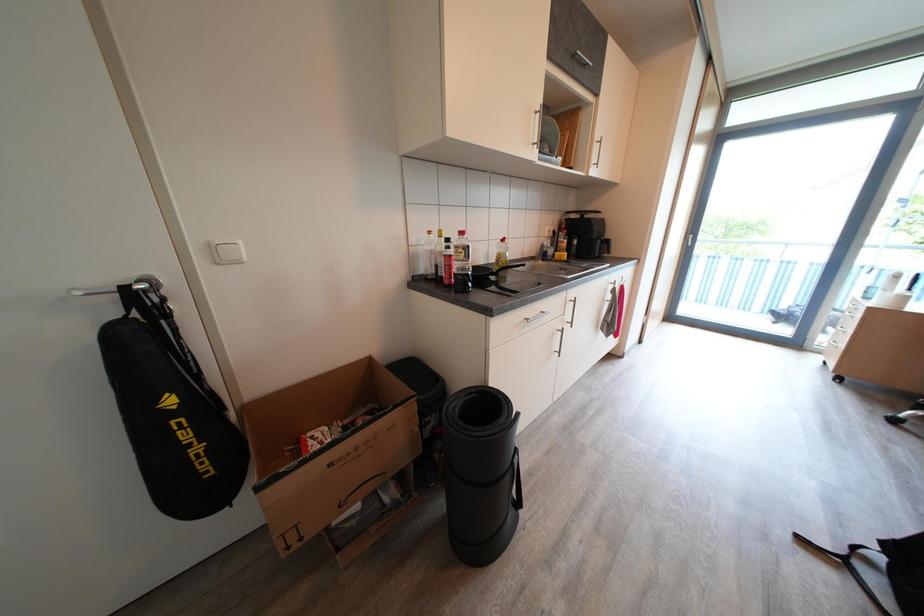
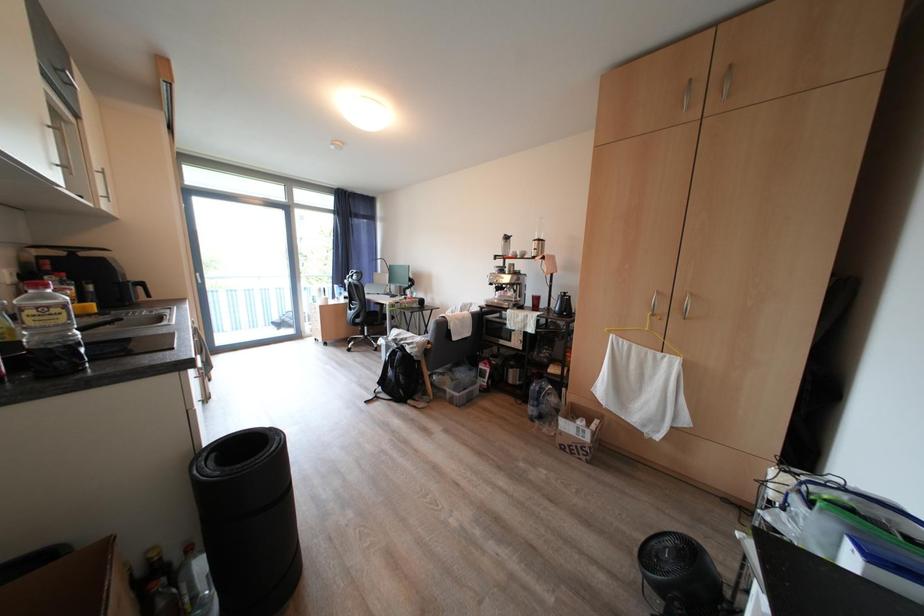
Question: The camera is either moving clockwise (left) or counter-clockwise (right) around the object. The first image is from the beginning of the video and the second image is from the end. Is the camera moving left or right when shooting the video?

Choices:
 (A) Left
 (B) Right

Answer: (A)